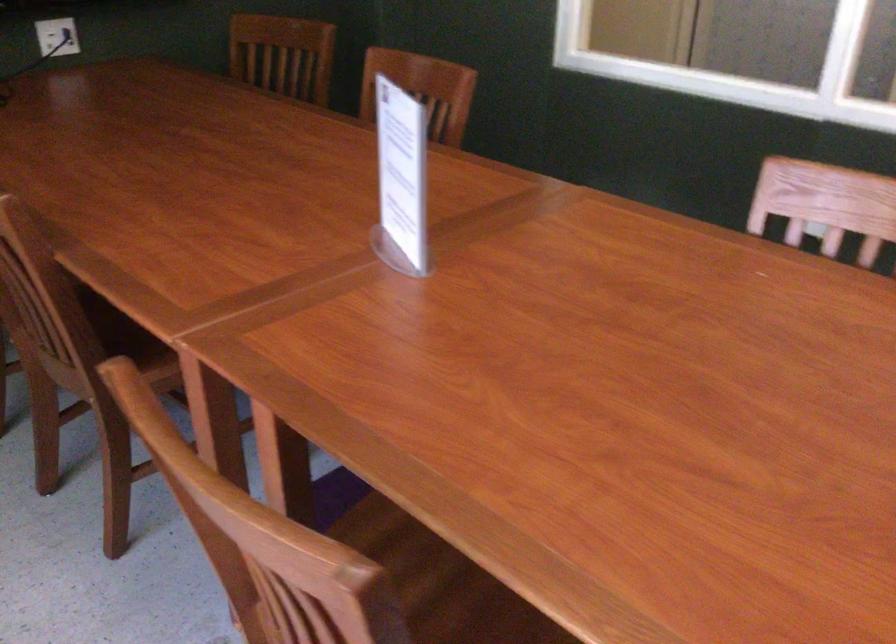
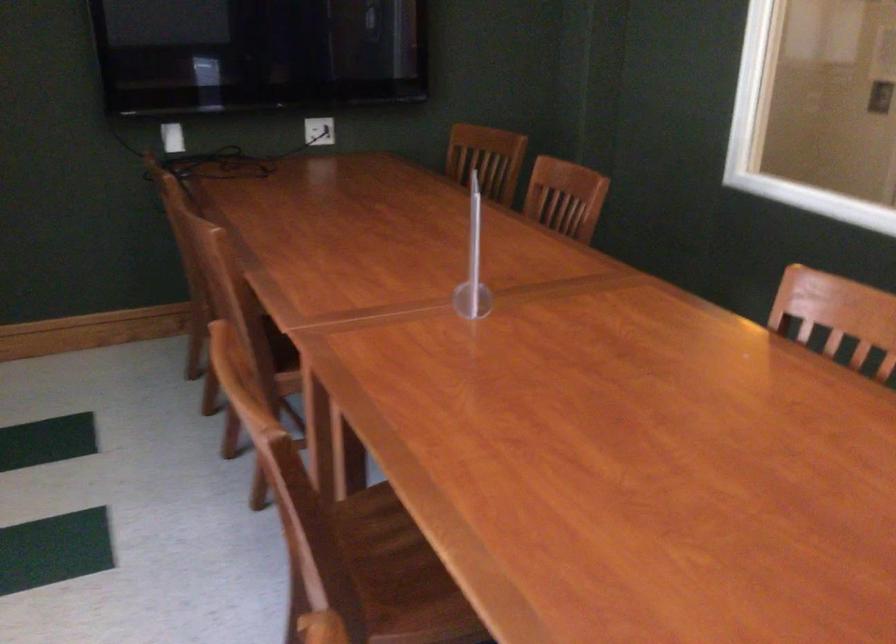
Question: How did the camera likely rotate?

Choices:
 (A) Left
 (B) Right
 (C) Up
 (D) Down

Answer: (A)